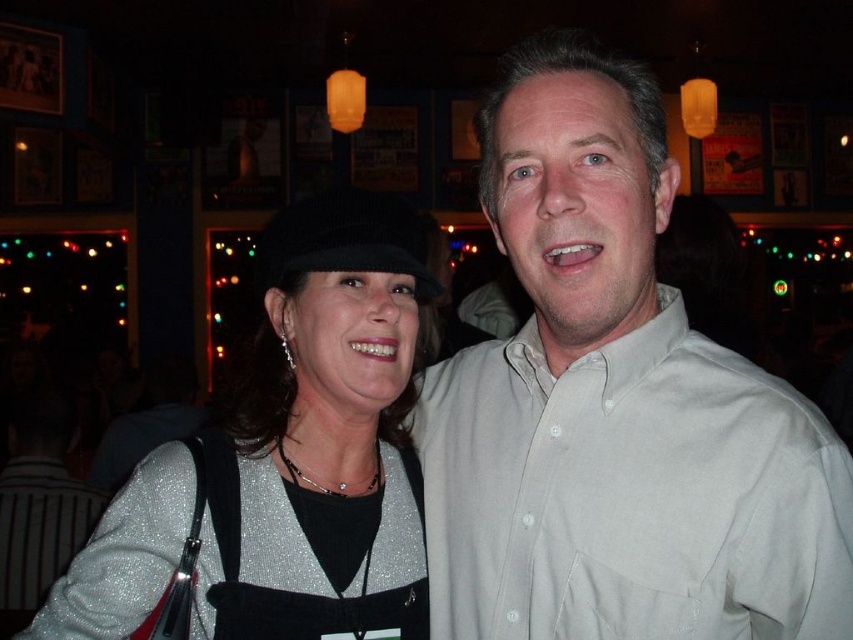
Is light gray cotton shirt at center smaller than sparkly silver sweater at left?

Incorrect, light gray cotton shirt at center is not smaller in size than sparkly silver sweater at left.

Based on the photo, is the position of light gray cotton shirt at center less distant than that of sparkly silver sweater at left?

That is True.

Is point (561, 515) positioned in front of point (155, 502)?

That is True.

Find the location of `light gray cotton shirt at center`. light gray cotton shirt at center is located at coordinates (630, 493).

The width and height of the screenshot is (853, 640). I want to click on smooth beige shirt at center, so click(x=577, y=205).

Which is behind, point (585, 410) or point (373, 406)?

The point (373, 406) is behind.

Can you confirm if light gray cotton shirt at center is wider than satin silver necklace at center?

Indeed, light gray cotton shirt at center has a greater width compared to satin silver necklace at center.

What are the coordinates of `light gray cotton shirt at center` in the screenshot? It's located at (630, 493).